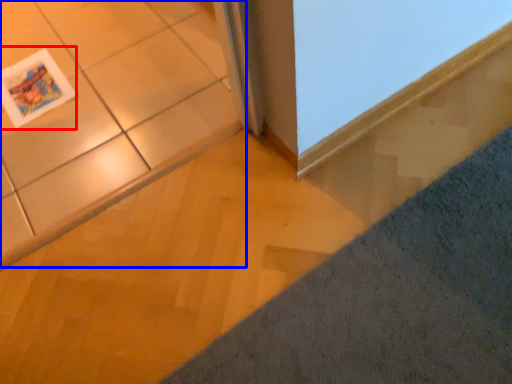
Question: Which of the following is the closest to the observer, magazine (highlighted by a red box) or ceramic tile (highlighted by a blue box)?

Choices:
 (A) magazine
 (B) ceramic tile

Answer: (B)